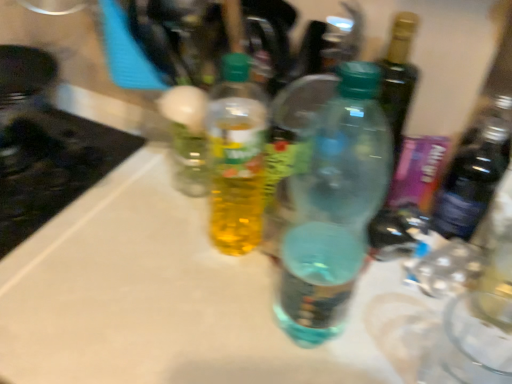
This screenshot has width=512, height=384. Find the location of `vacant space situated on the left part of translucent plastic bottle at center, acting as the 1th bottle starting from the right`. vacant space situated on the left part of translucent plastic bottle at center, acting as the 1th bottle starting from the right is located at coordinates (193, 326).